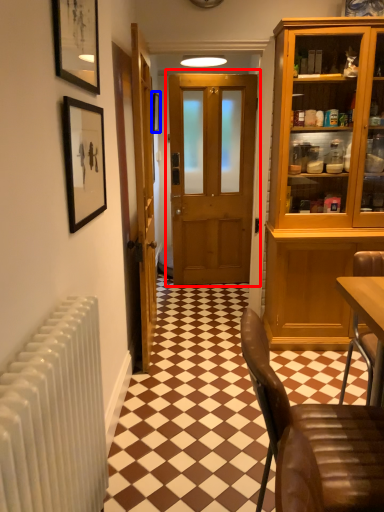
Question: Which point is further to the camera, door (highlighted by a red box) or picture frame (highlighted by a blue box)?

Choices:
 (A) door
 (B) picture frame

Answer: (B)